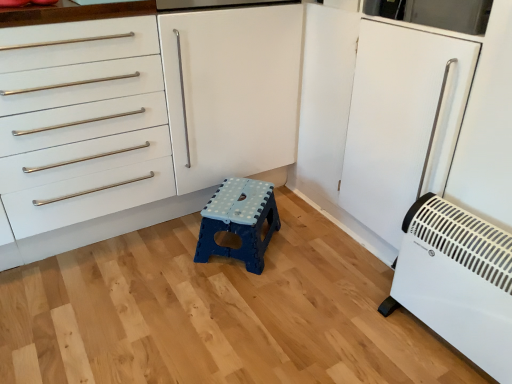
At what (x,y) coordinates should I click in order to perform the action: click on vacant space in front of blue plastic stool at center. Please return your answer as a coordinate pair (x, y). Looking at the image, I should click on click(x=232, y=301).